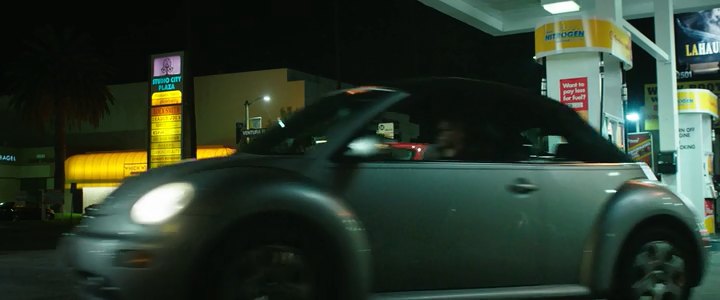
Identify the location of square light. (566, 6).